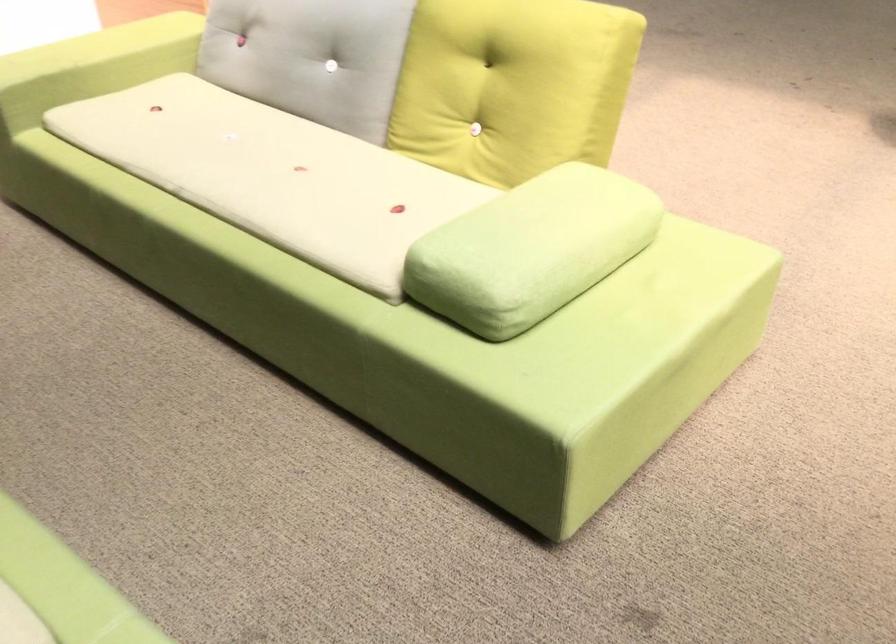
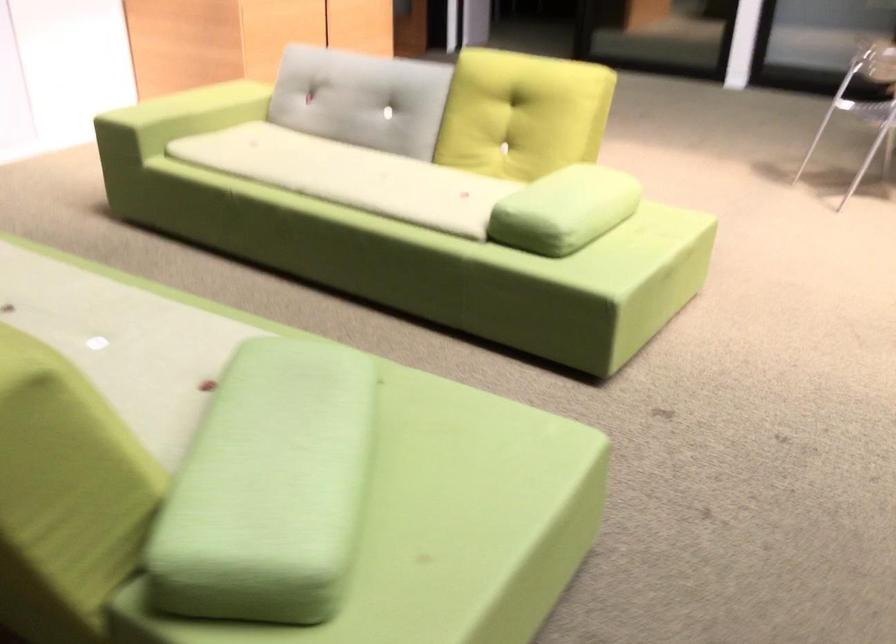
Question: I am providing you with two images of the same scene from different viewpoints. Which of the following objects are not visible in image2?

Choices:
 (A) sofa sitting surface
 (B) yellow-green cushion
 (C) chair sitting surface
 (D) none of these

Answer: (D)